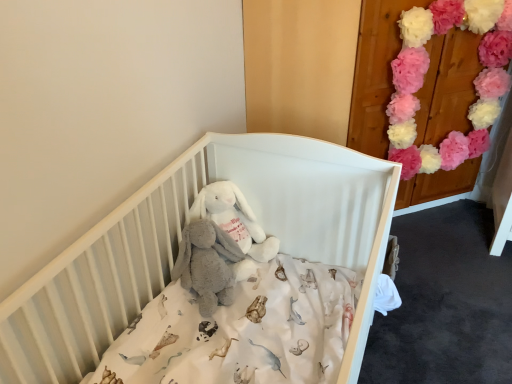
What do you see at coordinates (426, 71) in the screenshot? I see `pink fluffy pom-poms at upper right` at bounding box center [426, 71].

In order to face soft gray plush at center, should I rotate leftwards or rightwards?

It's best to rotate left around 6.134 degrees.

What do you see at coordinates (207, 264) in the screenshot? I see `soft gray plush at center` at bounding box center [207, 264].

Identify the location of pink fluffy pom-poms at upper right. (426, 71).

Is point (12, 350) positioned behind point (203, 311)?

No, (12, 350) is closer to viewer.

Between white matte crib at center and soft gray plush at center, which one has more height?

white matte crib at center is taller.

Is white matte crib at center looking in the opposite direction of soft gray plush at center?

Yes, white matte crib at center is facing away from soft gray plush at center.

This screenshot has height=384, width=512. What are the coordinates of `baby elephant that appears above the white matte crib at center (from the image's perspective)` in the screenshot? It's located at (207, 264).

Can you confirm if soft gray plush at center is thinner than white plush rabbit at center?

Yes, soft gray plush at center is thinner than white plush rabbit at center.

Considering the sizes of soft gray plush at center and white plush rabbit at center in the image, is soft gray plush at center taller or shorter than white plush rabbit at center?

Clearly, soft gray plush at center is taller compared to white plush rabbit at center.

Is soft gray plush at center with white plush rabbit at center?

Yes, soft gray plush at center is right next to white plush rabbit at center and making contact.

From the image's perspective, which is above, soft gray plush at center or white plush rabbit at center?

white plush rabbit at center is shown above in the image.

Between white plush rabbit at center and pink fluffy pom-poms at upper right, which one appears on the left side from the viewer's perspective?

white plush rabbit at center.

Do you think white plush rabbit at center is within pink fluffy pom-poms at upper right, or outside of it?

white plush rabbit at center is not enclosed by pink fluffy pom-poms at upper right.

Where is `toy to the left of pink fluffy pom-poms at upper right`? toy to the left of pink fluffy pom-poms at upper right is located at coordinates (234, 219).

Which of these two, soft gray plush at center or pink fluffy pom-poms at upper right, is bigger?

pink fluffy pom-poms at upper right.

Between soft gray plush at center and pink fluffy pom-poms at upper right, which one has more height?

pink fluffy pom-poms at upper right.

Considering the relative positions of soft gray plush at center and pink fluffy pom-poms at upper right in the image provided, is soft gray plush at center in front of pink fluffy pom-poms at upper right?

That is True.

Which object is wider, soft gray plush at center or pink fluffy pom-poms at upper right?

soft gray plush at center is wider.

How many degrees apart are the facing directions of white plush rabbit at center and white matte crib at center?

There is a 0.000104-degree angle between the facing directions of white plush rabbit at center and white matte crib at center.

Is white plush rabbit at center at the left side of white matte crib at center?

Correct, you'll find white plush rabbit at center to the left of white matte crib at center.

Does white plush rabbit at center have a greater width compared to white matte crib at center?

In fact, white plush rabbit at center might be narrower than white matte crib at center.

This screenshot has height=384, width=512. Find the location of `infant bed below the white plush rabbit at center (from the image's perspective)`. infant bed below the white plush rabbit at center (from the image's perspective) is located at coordinates 180,237.

Is white matte crib at center inside soft gray plush at center?

No, white matte crib at center is not surrounded by soft gray plush at center.

Considering the positions of points (193, 283) and (377, 176), is point (193, 283) farther from camera compared to point (377, 176)?

Yes, it is.

What's the angular difference between soft gray plush at center and white matte crib at center's facing directions?

0.000632 degrees.

Who is smaller, soft gray plush at center or white matte crib at center?

With smaller size is soft gray plush at center.

Does white plush rabbit at center turn towards soft gray plush at center?

Yes.

This screenshot has height=384, width=512. What are the coordinates of `toy that is above the soft gray plush at center (from the image's perspective)` in the screenshot? It's located at (234, 219).

Is white plush rabbit at center in front of or behind soft gray plush at center in the image?

In the image, white plush rabbit at center appears behind soft gray plush at center.

From a real-world perspective, which object rests below the other?

soft gray plush at center, from a real-world perspective.

What are the coordinates of `infant bed on the right of the soft gray plush at center` in the screenshot? It's located at (180, 237).

Image resolution: width=512 pixels, height=384 pixels. What are the coordinates of `toy lying behind the soft gray plush at center` in the screenshot? It's located at (234, 219).

When comparing their distances from pink fluffy pom-poms at upper right, does white plush rabbit at center or white matte crib at center seem further?

Based on the image, white plush rabbit at center appears to be further to pink fluffy pom-poms at upper right.

When comparing their distances from white plush rabbit at center, does white matte crib at center or pink fluffy pom-poms at upper right seem closer?

Among the two, white matte crib at center is located nearer to white plush rabbit at center.

Estimate the real-world distances between objects in this image. Which object is further from pink fluffy pom-poms at upper right, white matte crib at center or white plush rabbit at center?

white plush rabbit at center.

Which object lies nearer to the anchor point white plush rabbit at center, soft gray plush at center or white matte crib at center?

The object closer to white plush rabbit at center is soft gray plush at center.

Looking at the image, which one is located closer to white matte crib at center, soft gray plush at center or white plush rabbit at center?

white plush rabbit at center is closer to white matte crib at center.

From the image, which object appears to be farther from white plush rabbit at center, pink fluffy pom-poms at upper right or white matte crib at center?

The object further to white plush rabbit at center is pink fluffy pom-poms at upper right.

From the picture: When comparing their distances from pink fluffy pom-poms at upper right, does soft gray plush at center or white plush rabbit at center seem closer?

white plush rabbit at center is positioned closer to the anchor pink fluffy pom-poms at upper right.

Estimate the real-world distances between objects in this image. Which object is further from white plush rabbit at center, white matte crib at center or soft gray plush at center?

Based on the image, white matte crib at center appears to be further to white plush rabbit at center.

Locate an element on the screen. The width and height of the screenshot is (512, 384). toy positioned between white matte crib at center and pink fluffy pom-poms at upper right from near to far is located at coordinates (234, 219).

Identify the location of toy located between soft gray plush at center and pink fluffy pom-poms at upper right in the left-right direction. (234, 219).

Where is `baby elephant positioned between white matte crib at center and white plush rabbit at center from near to far`? This screenshot has height=384, width=512. baby elephant positioned between white matte crib at center and white plush rabbit at center from near to far is located at coordinates (207, 264).

You are a GUI agent. You are given a task and a screenshot of the screen. Output one action in this format:
    pyautogui.click(x=<x>, y=<y>)
    Task: Click on the infant bed located between soft gray plush at center and pink fluffy pom-poms at upper right in the left-right direction
    The image size is (512, 384).
    Given the screenshot: What is the action you would take?
    pyautogui.click(x=180, y=237)